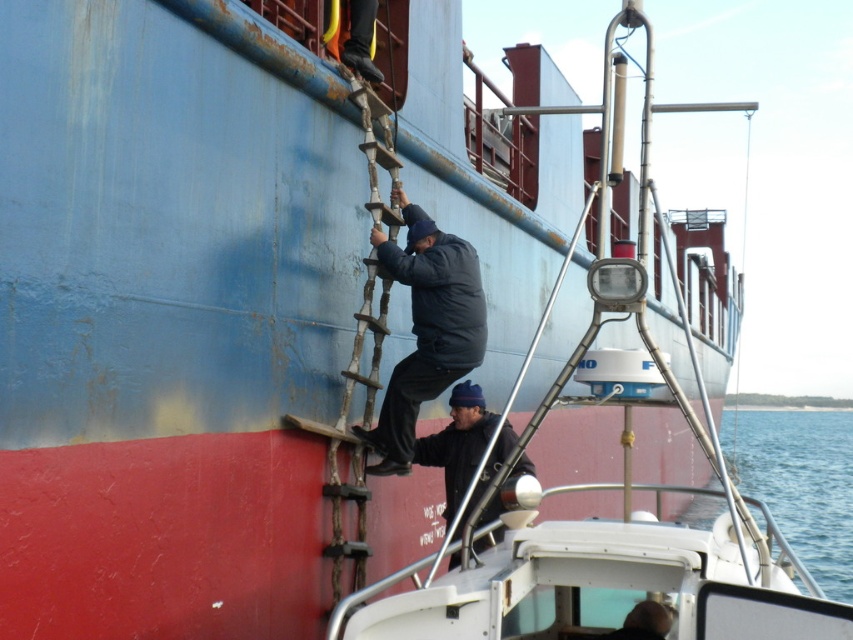
This screenshot has width=853, height=640. Find the location of `blue water at lower right`. blue water at lower right is located at coordinates (799, 483).

Does point (833, 573) come behind point (370, 305)?

That is True.

At what (x,y) coordinates should I click in order to perform the action: click on blue water at lower right. Please return your answer as a coordinate pair (x, y). The height and width of the screenshot is (640, 853). Looking at the image, I should click on (799, 483).

Can you confirm if blue water at lower right is thinner than dark blue knit cap at center?

No, blue water at lower right is not thinner than dark blue knit cap at center.

Is blue water at lower right bigger than dark blue knit cap at center?

Yes.

This screenshot has height=640, width=853. What do you see at coordinates (799, 483) in the screenshot? I see `blue water at lower right` at bounding box center [799, 483].

Locate an element on the screen. blue water at lower right is located at coordinates (799, 483).

Who is lower down, blue water at lower right or dark blue padded jacket at center?

blue water at lower right is lower down.

Does point (746, 481) come in front of point (448, 241)?

No, (746, 481) is behind (448, 241).

Where is `blue water at lower right`? blue water at lower right is located at coordinates (799, 483).

Where is `blue water at lower right`? The height and width of the screenshot is (640, 853). blue water at lower right is located at coordinates (799, 483).